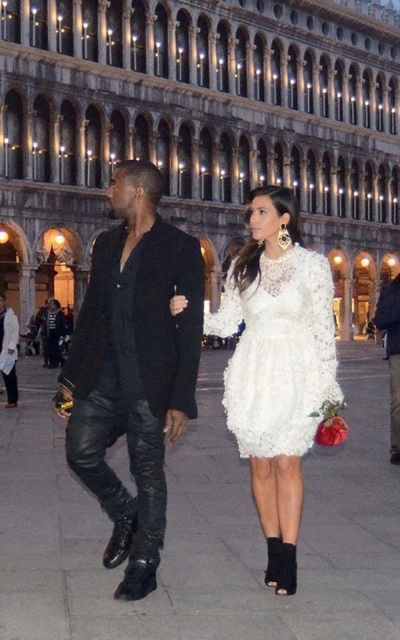
Who is higher up, black leather pants at center or white lace dress at center?

Positioned higher is black leather pants at center.

This screenshot has height=640, width=400. What do you see at coordinates (133, 369) in the screenshot?
I see `black leather pants at center` at bounding box center [133, 369].

Measure the distance between black leather pants at center and camera.

A distance of 84.62 feet exists between black leather pants at center and camera.

Locate an element on the screen. The width and height of the screenshot is (400, 640). black leather pants at center is located at coordinates (133, 369).

Who is more forward, (243, 413) or (394, 413)?

Point (243, 413) is in front.

Where is `white lace dress at center`? white lace dress at center is located at coordinates (279, 353).

Looking at this image, who is more forward, (235, 305) or (390, 365)?

Point (235, 305) is in front.

Where is `white lace dress at center`? This screenshot has height=640, width=400. white lace dress at center is located at coordinates (279, 353).

Is black leather pants at center to the right of black leather pants at lower left from the viewer's perspective?

In fact, black leather pants at center is to the left of black leather pants at lower left.

At what (x,y) coordinates should I click in order to perform the action: click on black leather pants at center. Please return your answer as a coordinate pair (x, y). The image size is (400, 640). Looking at the image, I should click on (133, 369).

Who is more forward, (86, 470) or (389, 301)?

Point (86, 470) is more forward.

Identify the location of black leather pants at center. (133, 369).